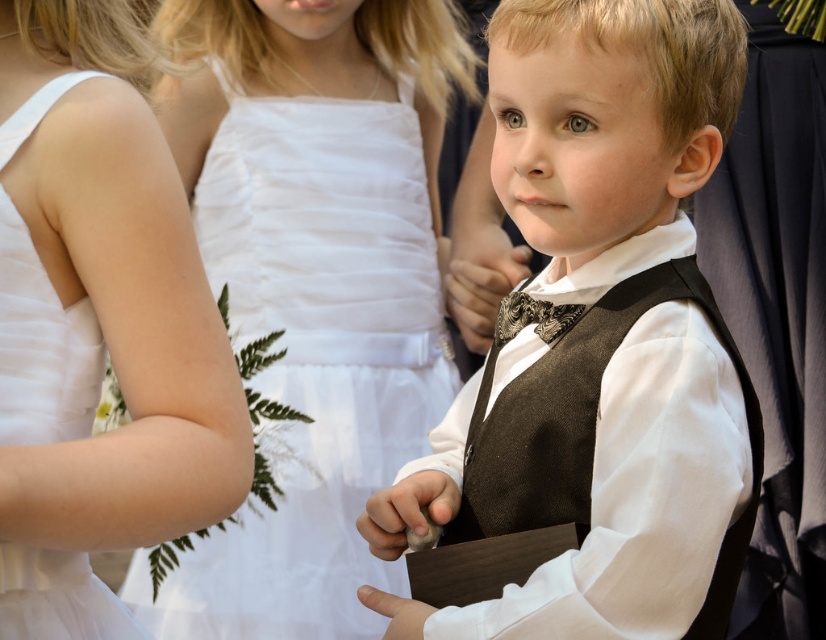
You are a photographer adjusting the camera focus. You need to ensure both the matte brown vest at center and the shiny metallic bow tie at center are in focus. Which one should you focus on first to account for their sizes?

The matte brown vest at center is taller than the shiny metallic bow tie at center, so you should focus on the matte brown vest at center first since it is larger and requires more precise focus.